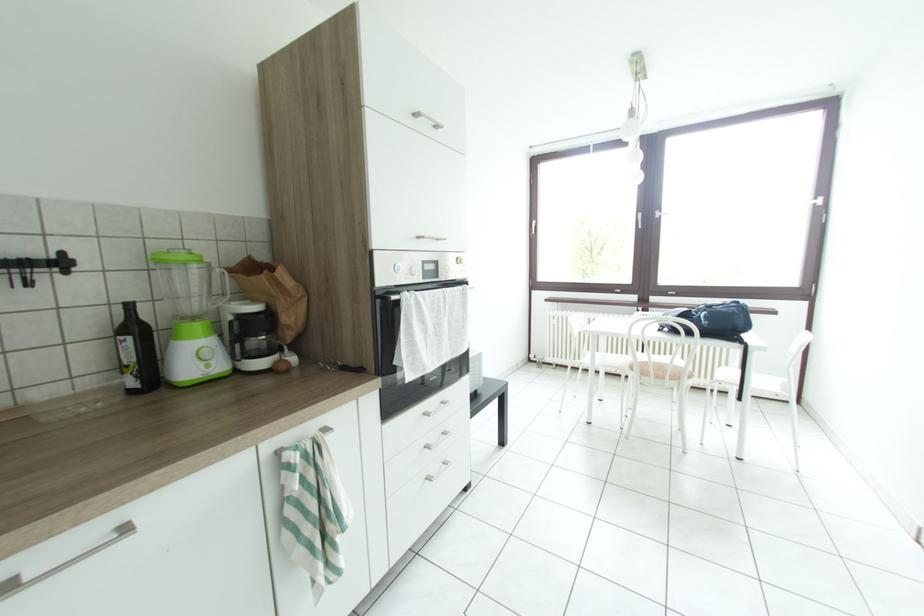
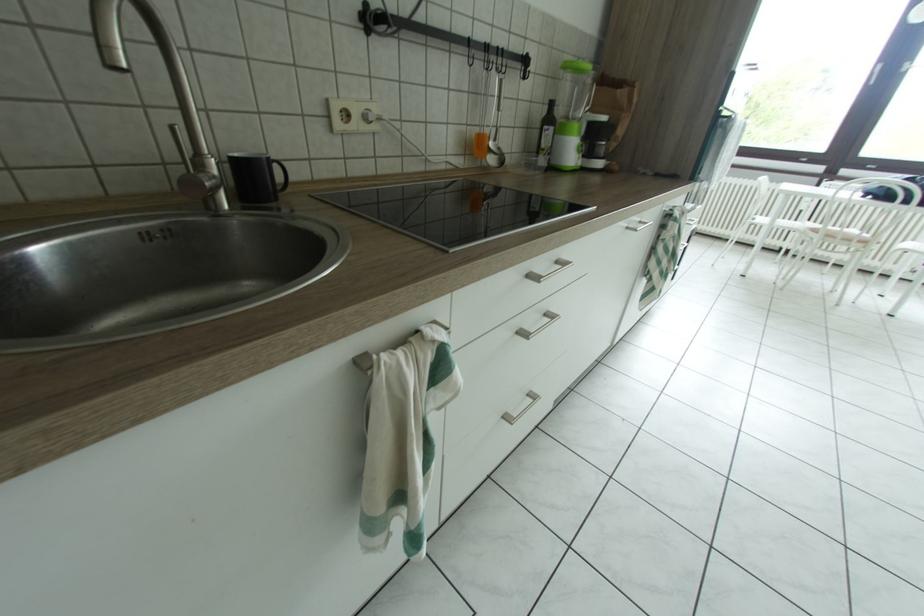
In a continuous first-person perspective shot, in which direction is the camera moving?

The movement direction of the cameraman is left, backward.